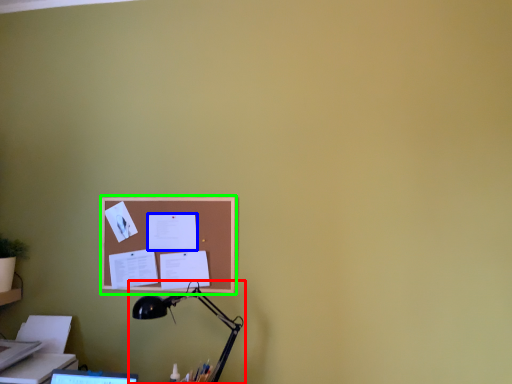
Question: Estimate the real-world distances between objects in this image. Which object is closer to lamp (highlighted by a red box), paper (highlighted by a blue box) or bulletin board (highlighted by a green box)?

Choices:
 (A) paper
 (B) bulletin board

Answer: (B)